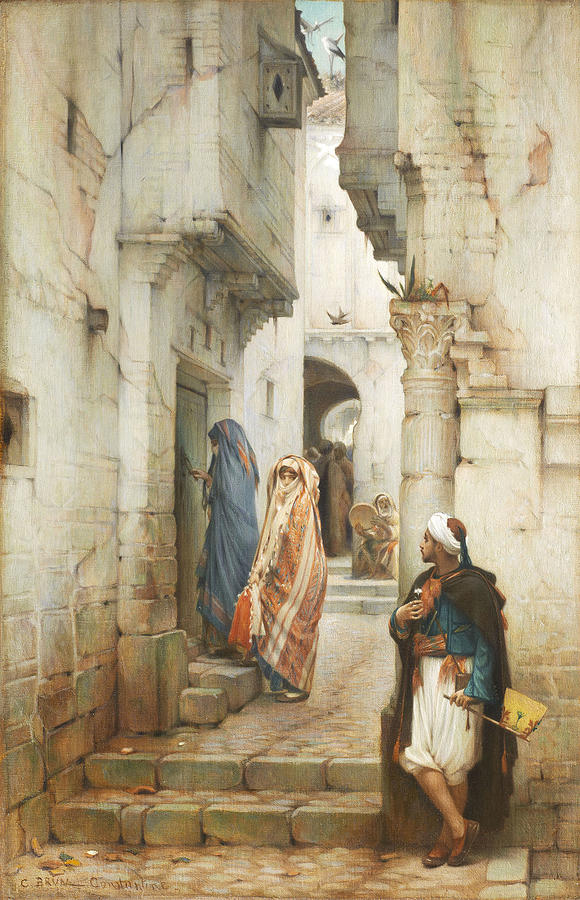
This screenshot has width=580, height=900. I want to click on stairs, so [307, 771], [284, 821], [367, 598], [205, 673], [347, 587].